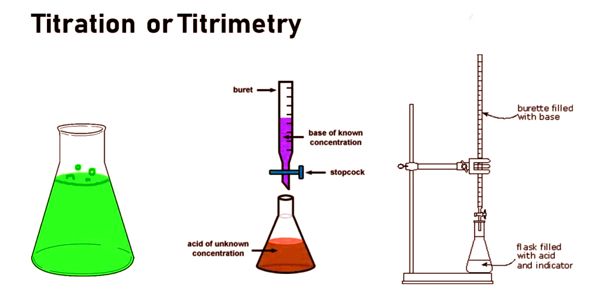
This screenshot has height=300, width=600. Find the location of `flask`. flask is located at coordinates (478, 248).